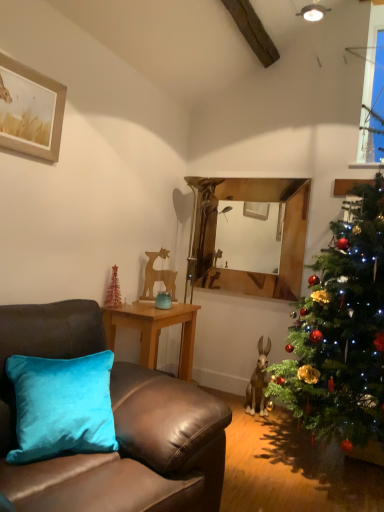
What are the coordinates of `vacant space to the right of metallic gold christmas tree at lower left` in the screenshot? It's located at (138, 310).